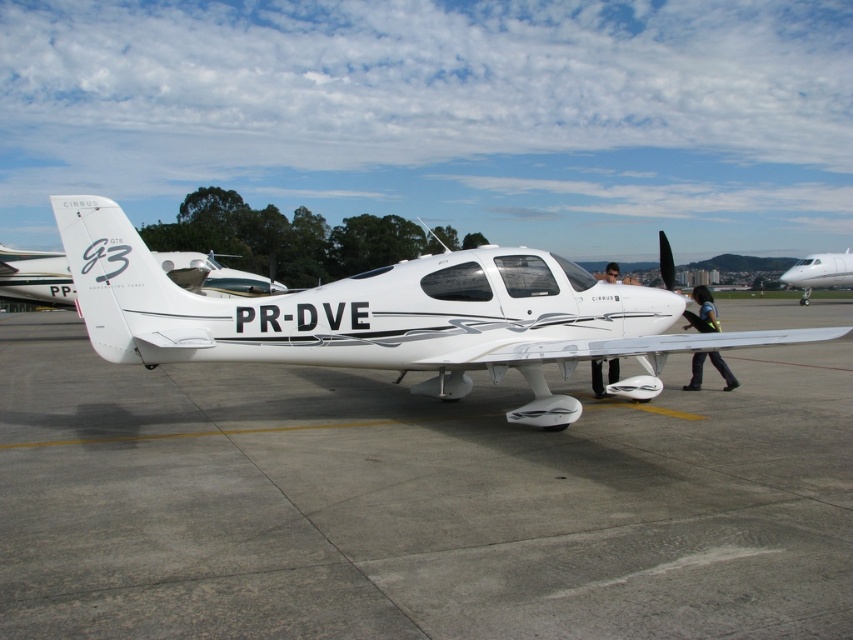
You are a maintenance worker at the airport. You need to move the matte black helmet at center to the storage area. However, there is a white glossy airplane at right in the way. Can you move the helmet without moving the airplane?

The white glossy airplane at right is shorter than the matte black helmet at center. Since the airplane is shorter, you can move the helmet over it without needing to move the airplane.

You are a pilot who needs to park your airplane on the tarmac. Based on the image, can the white glossy airplane at right fit on the gray concrete tarmac at center considering their widths?

The gray concrete tarmac at center is wider than the white glossy airplane at right, so the airplane can fit on the tarmac.

You are a maintenance worker at the airport. You need to move the white glossy airplane at right and the matte black helmet at center to a storage area. Since the storage area has a narrow entrance, which object should you move first to ensure it fits through the entrance?

The white glossy airplane at right has a lesser width compared to the matte black helmet at center, so you should move the white glossy airplane at right first to ensure it fits through the narrow entrance.